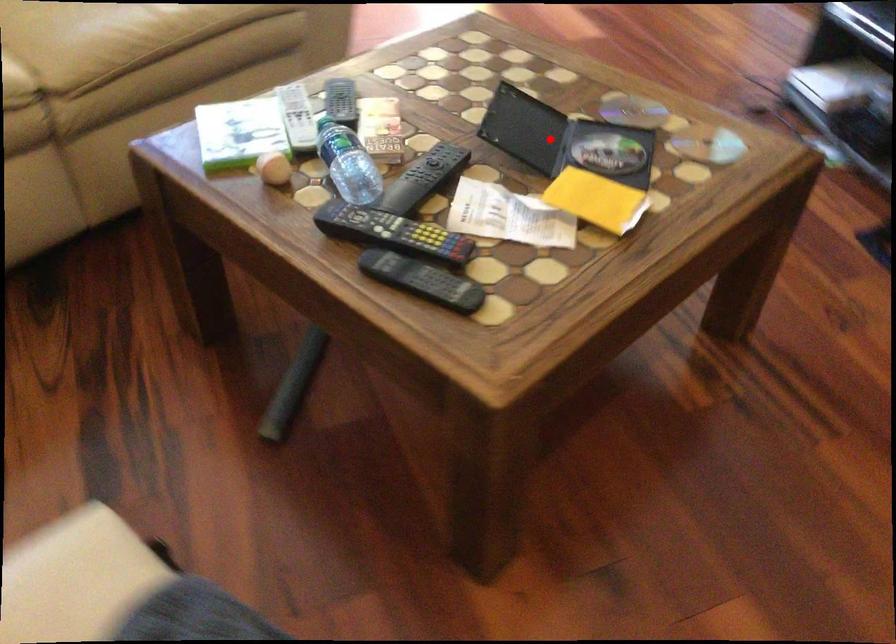
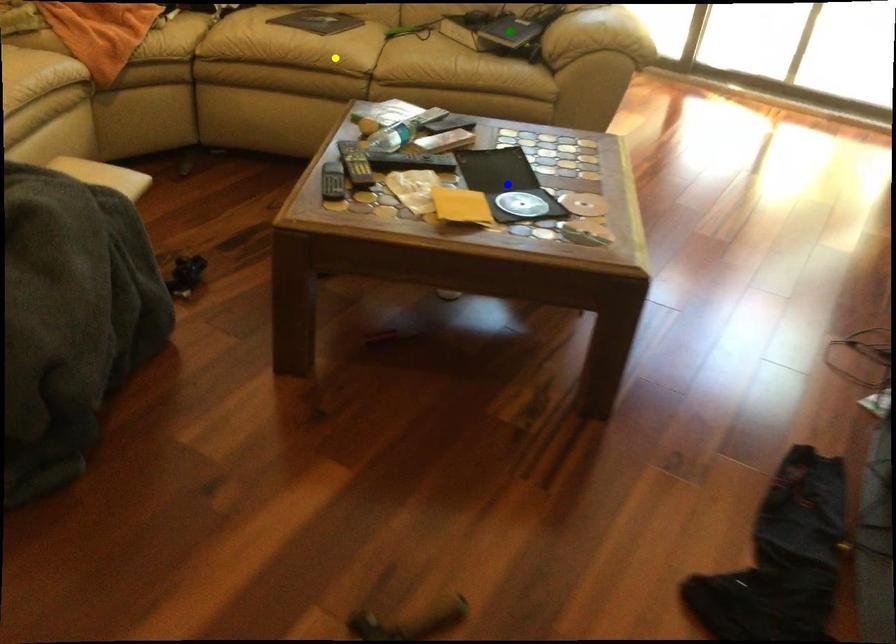
Question: I am providing you with two images of the same scene from different viewpoints. A red point is marked on the first image. You are given multiple points on the second image. Can you choose the point in image 2 that corresponds to the point in image 1?

Choices:
 (A) blue point
 (B) yellow point
 (C) green point

Answer: (A)